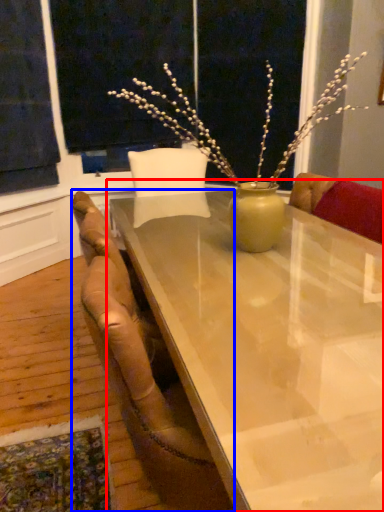
Question: Which object is closer to the camera taking this photo, table (highlighted by a red box) or chair (highlighted by a blue box)?

Choices:
 (A) table
 (B) chair

Answer: (A)